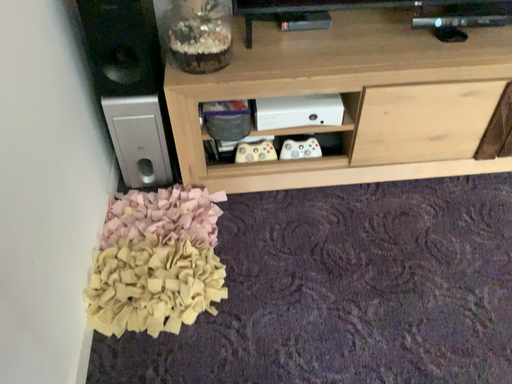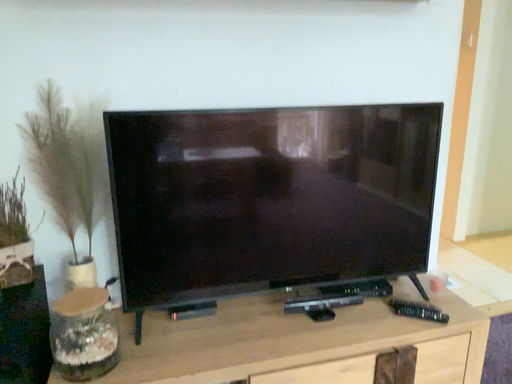
Question: Which way did the camera rotate in the video?

Choices:
 (A) rotated right
 (B) rotated left

Answer: (A)